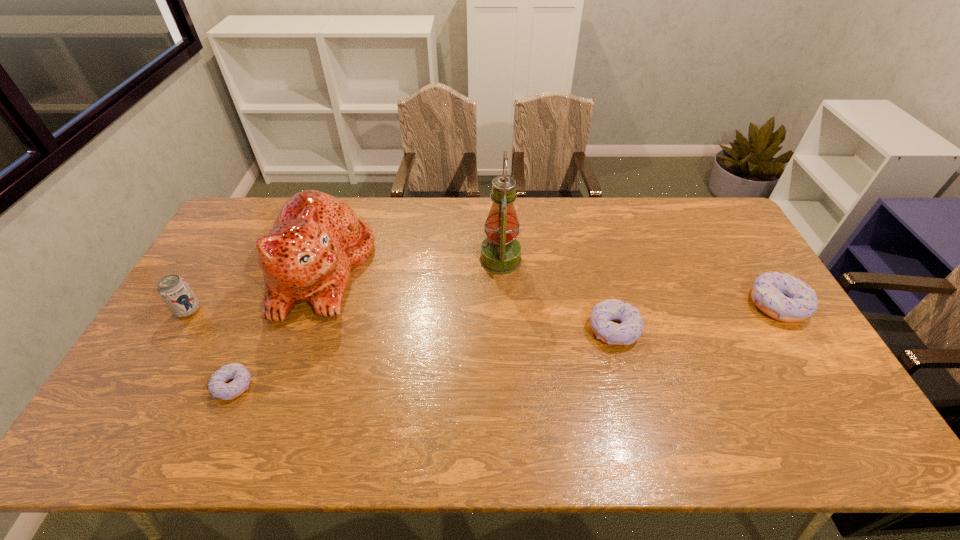
What are the coordinates of `vacant point that satisfies the following two spatial constraints: 1. on the face of the fifth shortest object; 2. on the left side of the rightmost object` in the screenshot? It's located at (309, 305).

Find the location of `free region that satisfies the following two spatial constraints: 1. on the front side of the oil lamp; 2. on the left side of the second shortest doughnut`. free region that satisfies the following two spatial constraints: 1. on the front side of the oil lamp; 2. on the left side of the second shortest doughnut is located at coordinates (504, 329).

The image size is (960, 540). In order to click on free point that satisfies the following two spatial constraints: 1. on the front side of the rightmost doughnut; 2. on the left side of the oil lamp in this screenshot , I will do pyautogui.click(x=503, y=305).